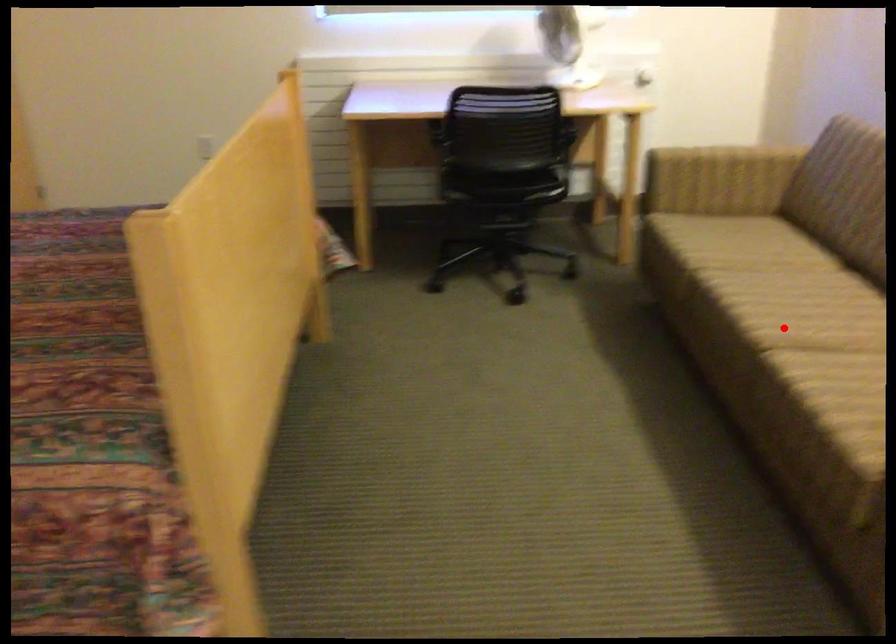
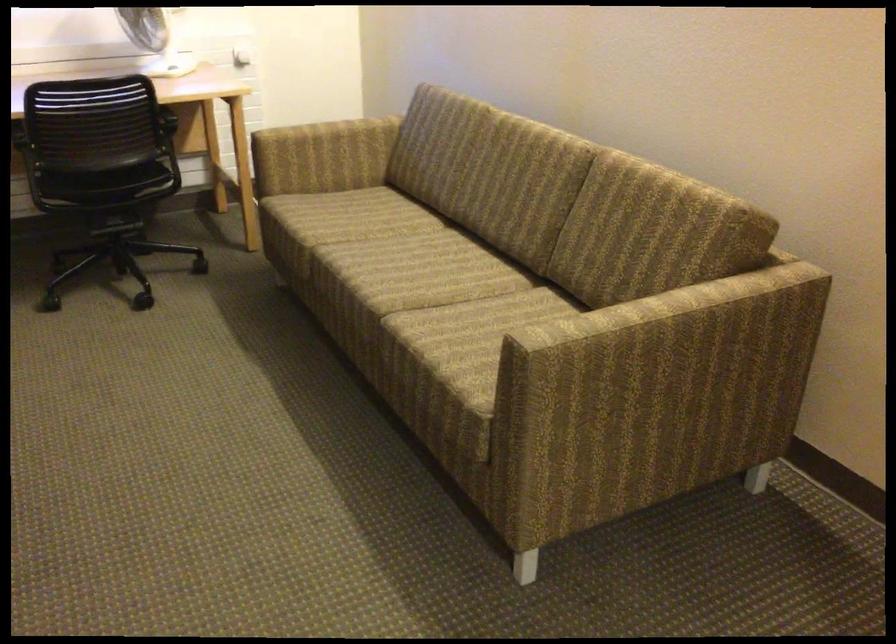
Locate, in the second image, the point that corresponds to the highlighted location in the first image.

(395, 289)